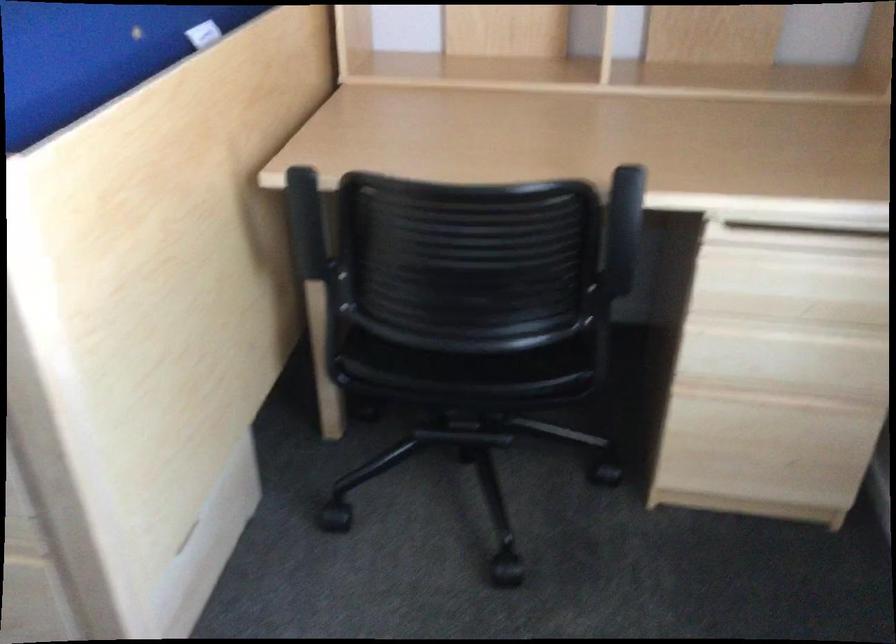
Describe the element at coordinates (433, 361) in the screenshot. This screenshot has width=896, height=644. I see `the chair sitting surface` at that location.